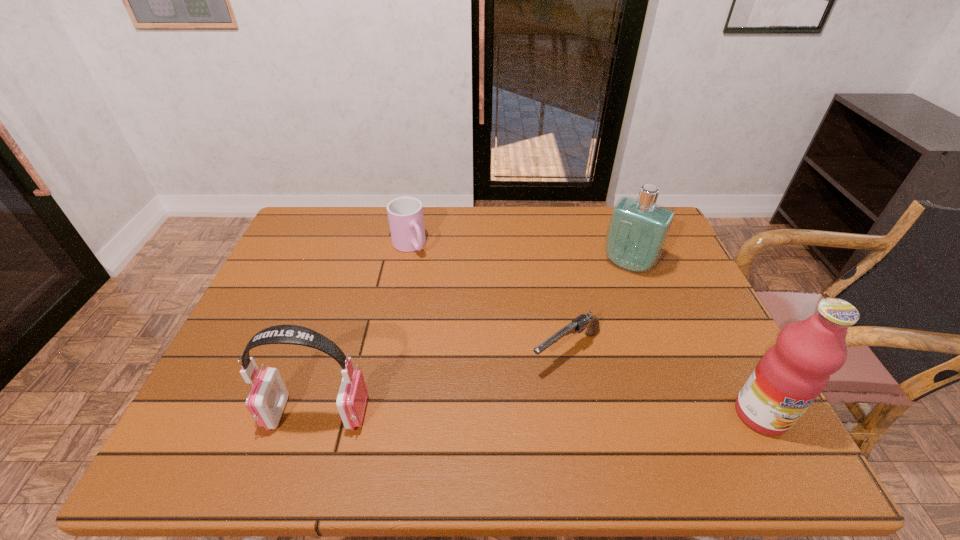
Find the location of `earphone`. earphone is located at coordinates (266, 401).

In order to click on the tallest object in this screenshot , I will do `click(792, 373)`.

You are a GUI agent. You are given a task and a screenshot of the screen. Output one action in this format:
    pyautogui.click(x=<x>, y=<y>)
    Task: Click on the fruit juice
    This screenshot has width=960, height=540.
    Given the screenshot: What is the action you would take?
    click(x=792, y=373)

Where is `cup`? cup is located at coordinates (405, 214).

At what (x,y) coordinates should I click in order to perform the action: click on perfume. Please return your answer as a coordinate pair (x, y). The width and height of the screenshot is (960, 540). Looking at the image, I should click on (638, 229).

I want to click on the third object from left to right, so click(578, 325).

This screenshot has height=540, width=960. Identify the location of gun. (578, 325).

Find the location of a particular element. free point located 0.070m on the outer surface of the earphone is located at coordinates (236, 413).

Where is `vacant space located 0.120m on the outer surface of the earphone`? The width and height of the screenshot is (960, 540). vacant space located 0.120m on the outer surface of the earphone is located at coordinates (214, 413).

Locate an element on the screen. The image size is (960, 540). free region located 0.070m on the outer surface of the earphone is located at coordinates (236, 413).